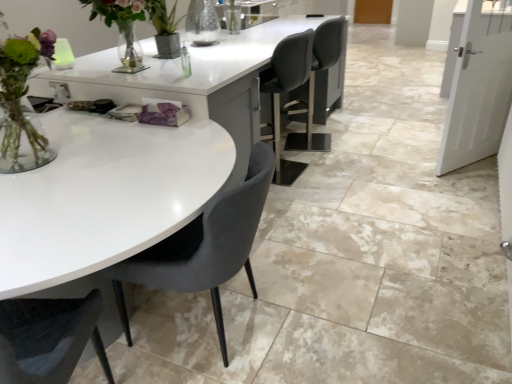
This screenshot has height=384, width=512. I want to click on vacant area situated below velvet grey chair at center (from a real-world perspective), so coord(207,327).